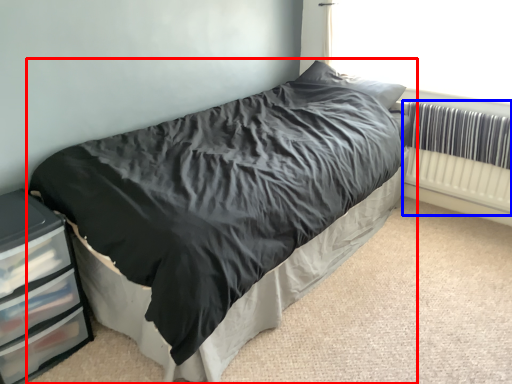
Question: Which point is closer to the camera, bed (highlighted by a red box) or radiator (highlighted by a blue box)?

Choices:
 (A) bed
 (B) radiator

Answer: (A)